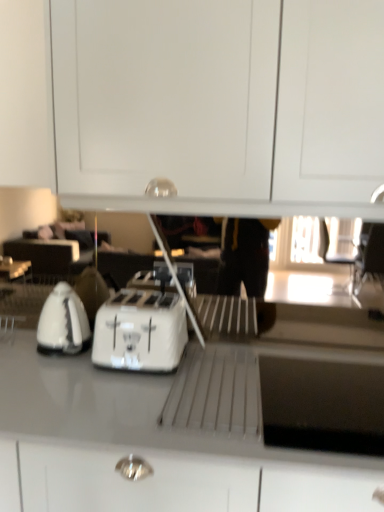
Question: Can you confirm if white glossy countertop at center is taller than white glossy cabinet at upper center?

Choices:
 (A) yes
 (B) no

Answer: (A)

Question: Could you tell me if white glossy countertop at center is turned towards white glossy cabinet at upper center?

Choices:
 (A) yes
 (B) no

Answer: (B)

Question: From a real-world perspective, is white glossy countertop at center positioned over white glossy cabinet at upper center based on gravity?

Choices:
 (A) no
 (B) yes

Answer: (A)

Question: Does white glossy countertop at center appear on the left side of white glossy cabinet at upper center?

Choices:
 (A) no
 (B) yes

Answer: (B)

Question: From a real-world perspective, does white glossy countertop at center sit lower than white glossy cabinet at upper center?

Choices:
 (A) yes
 (B) no

Answer: (A)

Question: Is point (142, 61) positioned closer to the camera than point (44, 301)?

Choices:
 (A) closer
 (B) farther

Answer: (A)

Question: Based on their positions, is white glossy cabinet at upper center located to the left or right of white glossy kettle at left?

Choices:
 (A) right
 (B) left

Answer: (A)

Question: In terms of size, does white glossy cabinet at upper center appear bigger or smaller than white glossy kettle at left?

Choices:
 (A) big
 (B) small

Answer: (A)

Question: Is white glossy cabinet at upper center in front of or behind white glossy kettle at left in the image?

Choices:
 (A) front
 (B) behind

Answer: (A)

Question: Does point (84, 344) appear closer or farther from the camera than point (150, 368)?

Choices:
 (A) closer
 (B) farther

Answer: (B)

Question: From a real-world perspective, relative to white plastic toaster at center, is white glossy kettle at left vertically above or below?

Choices:
 (A) below
 (B) above

Answer: (B)

Question: From the image's perspective, is white glossy kettle at left positioned above or below white plastic toaster at center?

Choices:
 (A) below
 (B) above

Answer: (B)

Question: Based on their positions, is white glossy kettle at left located to the left or right of white plastic toaster at center?

Choices:
 (A) right
 (B) left

Answer: (B)

Question: In the image, is white plastic toaster at center positioned in front of or behind white glossy cabinet at upper center?

Choices:
 (A) front
 (B) behind

Answer: (B)

Question: Is white plastic toaster at center to the left or to the right of white glossy cabinet at upper center in the image?

Choices:
 (A) right
 (B) left

Answer: (B)